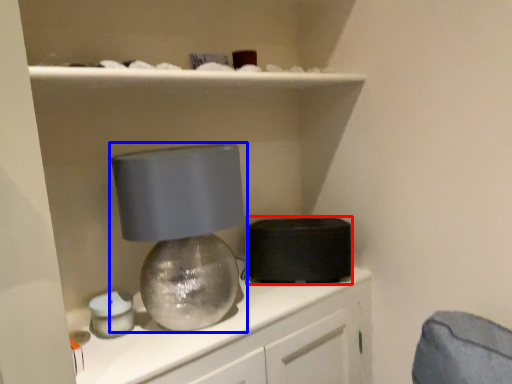
Question: Which point is further to the camera, appliance (highlighted by a red box) or lamp (highlighted by a blue box)?

Choices:
 (A) appliance
 (B) lamp

Answer: (A)